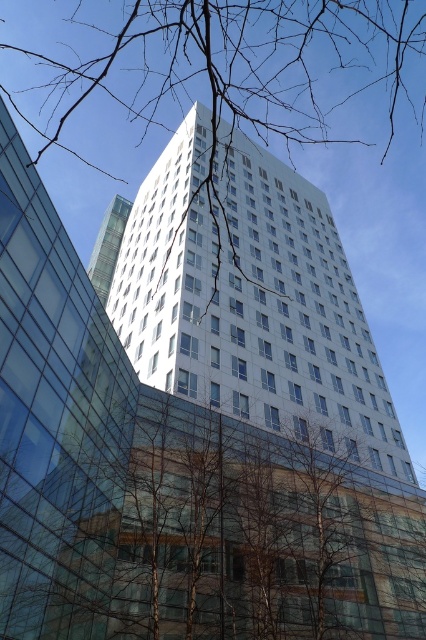
Question: Is brown leafless tree at lower center closer to the viewer compared to transparent glass building at center?

Choices:
 (A) no
 (B) yes

Answer: (A)

Question: Is brown leafless tree at lower center in front of transparent glass building at center?

Choices:
 (A) no
 (B) yes

Answer: (A)

Question: Is transparent glass building at center to the right of transparent glass tower at center from the viewer's perspective?

Choices:
 (A) yes
 (B) no

Answer: (A)

Question: Estimate the real-world distances between objects in this image. Which object is farther from the transparent glass building at center?

Choices:
 (A) bare branches at upper center
 (B) brown leafless tree at lower center
 (C) white glass building at center
 (D) transparent glass tower at center

Answer: (A)

Question: Considering the real-world distances, which object is closest to the transparent glass building at center?

Choices:
 (A) bare branches at upper center
 (B) transparent glass tower at center
 (C) brown leafless tree at lower center

Answer: (C)

Question: Which of these objects is positioned farthest from the brown leafless tree at lower center?

Choices:
 (A) transparent glass building at center
 (B) bare branches at upper center

Answer: (B)